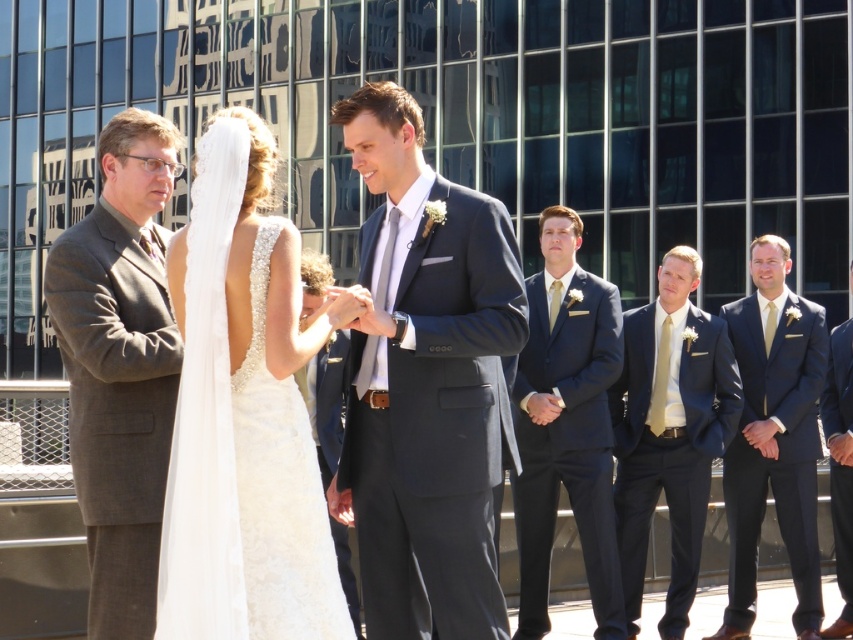
You are standing in the wedding ceremony scene and want to know which of the two points, point [202,289] or point [839,330], is closer to you. Can you determine this based on the scene?

Point [202,289] is closer to the viewer than point [839,330].

You are a photographer at a wedding. You need to capture a photo of the white lace dress at center and the dark blue suit at right. Based on their heights, which one should you focus on first to ensure both are in frame?

The white lace dress at center is taller than the dark blue suit at right, so you should focus on the white lace dress at center first to ensure both are in frame.

In the wedding scene described, where exactly is the matte navy suit at center located in terms of its 2D coordinates?

The matte navy suit at center is located at the 2D coordinates point (669, 433).